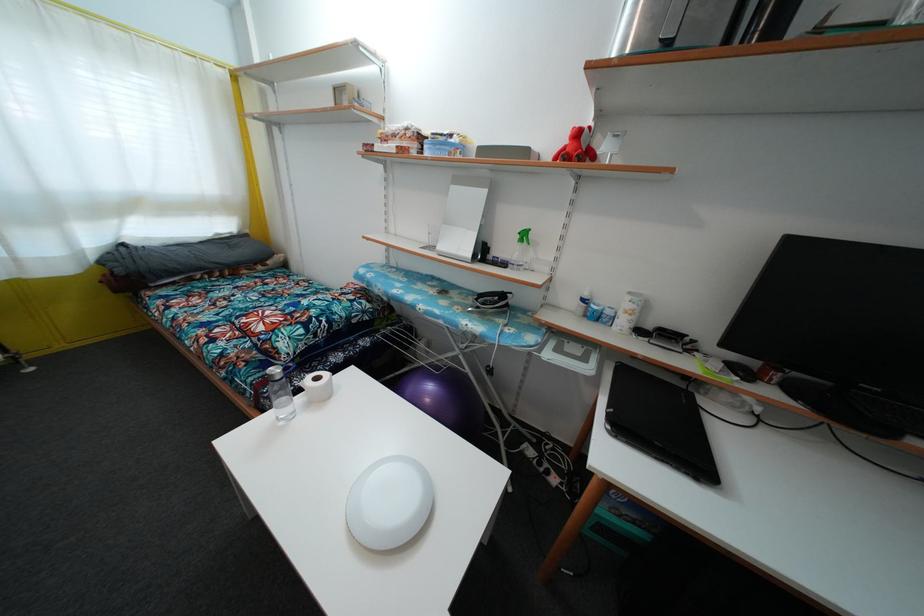
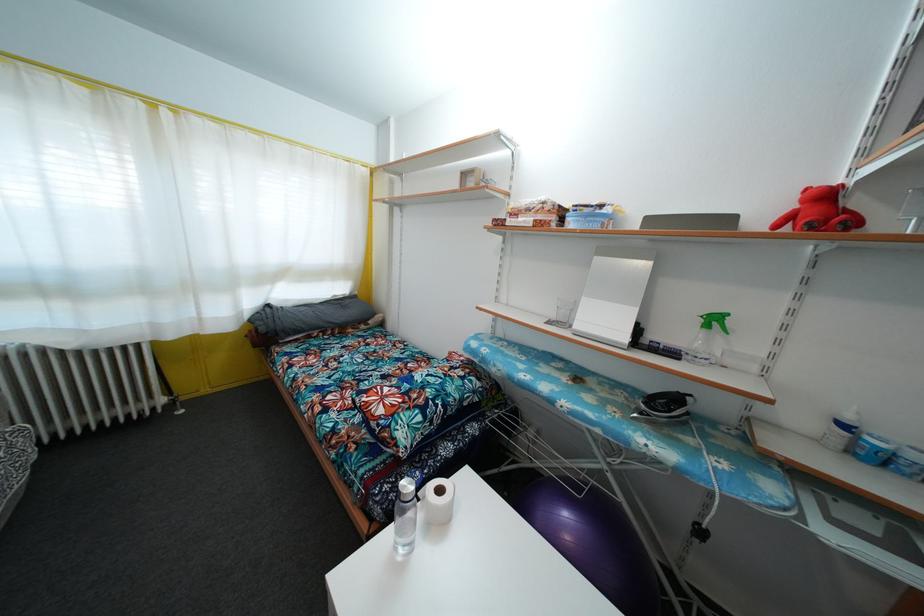
In the second image, find the point that corresponds to point 321,386 in the first image.

(444, 498)